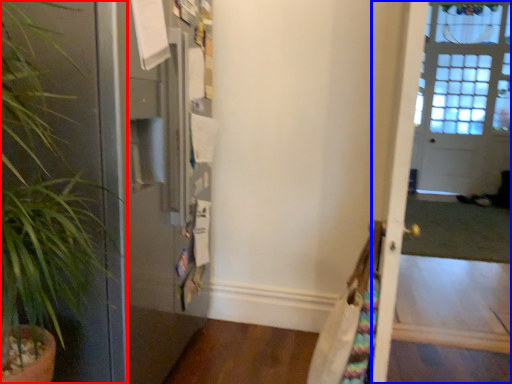
Question: Which of the following is the closest to the observer, houseplant (highlighted by a red box) or screen door (highlighted by a blue box)?

Choices:
 (A) houseplant
 (B) screen door

Answer: (A)